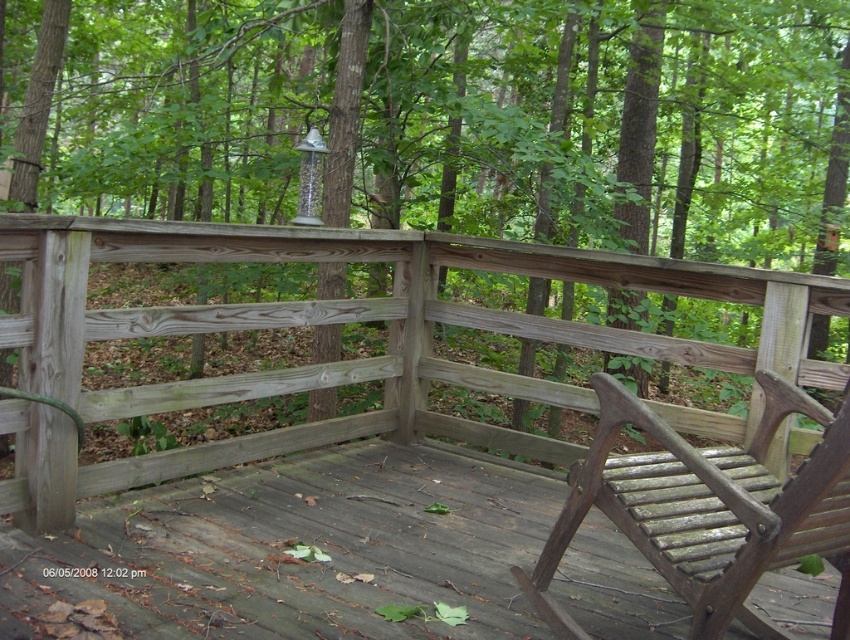
Is brown wood tree at center to the left of weathered wood porch at center from the viewer's perspective?

In fact, brown wood tree at center is to the right of weathered wood porch at center.

The image size is (850, 640). What are the coordinates of `brown wood tree at center` in the screenshot? It's located at (469, 138).

Is point (757, 131) closer to camera compared to point (707, 410)?

No.

At what (x,y) coordinates should I click in order to perform the action: click on brown wood tree at center. Please return your answer as a coordinate pair (x, y). This screenshot has height=640, width=850. Looking at the image, I should click on (469, 138).

Who is higher up, brown wood tree at center or weathered wood deck at center?

brown wood tree at center is higher up.

Which is more to the left, brown wood tree at center or weathered wood deck at center?

weathered wood deck at center

Where is `brown wood tree at center`? This screenshot has width=850, height=640. brown wood tree at center is located at coordinates (469, 138).

The width and height of the screenshot is (850, 640). In order to click on brown wood tree at center in this screenshot , I will do `click(469, 138)`.

Can you confirm if weathered wood porch at center is positioned to the right of wooden slats chair at lower right?

In fact, weathered wood porch at center is to the left of wooden slats chair at lower right.

Where is `weathered wood porch at center`? The height and width of the screenshot is (640, 850). weathered wood porch at center is located at coordinates (337, 360).

Locate an element on the screen. Image resolution: width=850 pixels, height=640 pixels. weathered wood porch at center is located at coordinates (337, 360).

Where is `weathered wood porch at center`? weathered wood porch at center is located at coordinates (337, 360).